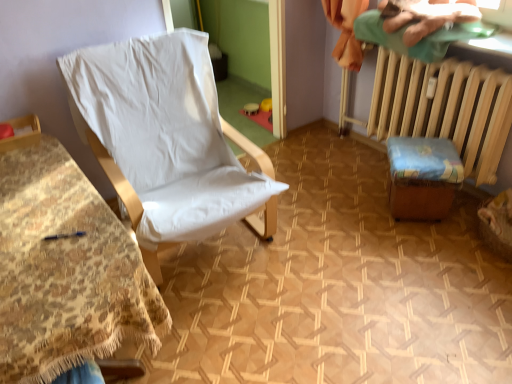
Image resolution: width=512 pixels, height=384 pixels. I want to click on free space above wooden stool at lower right, marked as the first furniture in a right-to-left arrangement (from a real-world perspective), so click(423, 149).